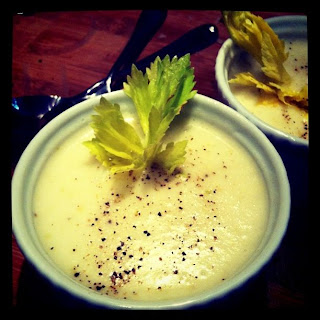
Find the location of a particular element. This screenshot has width=320, height=320. bowl is located at coordinates (276, 185).